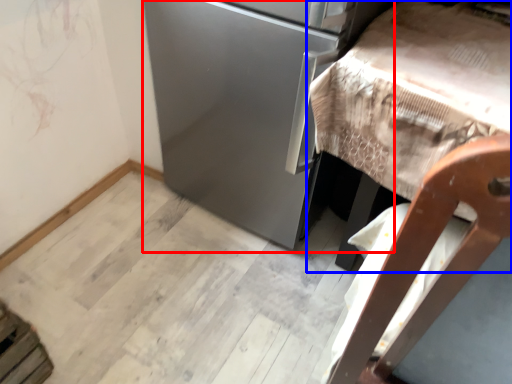
Question: Which point is further to the camera, appliance (highlighted by a red box) or furniture (highlighted by a blue box)?

Choices:
 (A) appliance
 (B) furniture

Answer: (A)